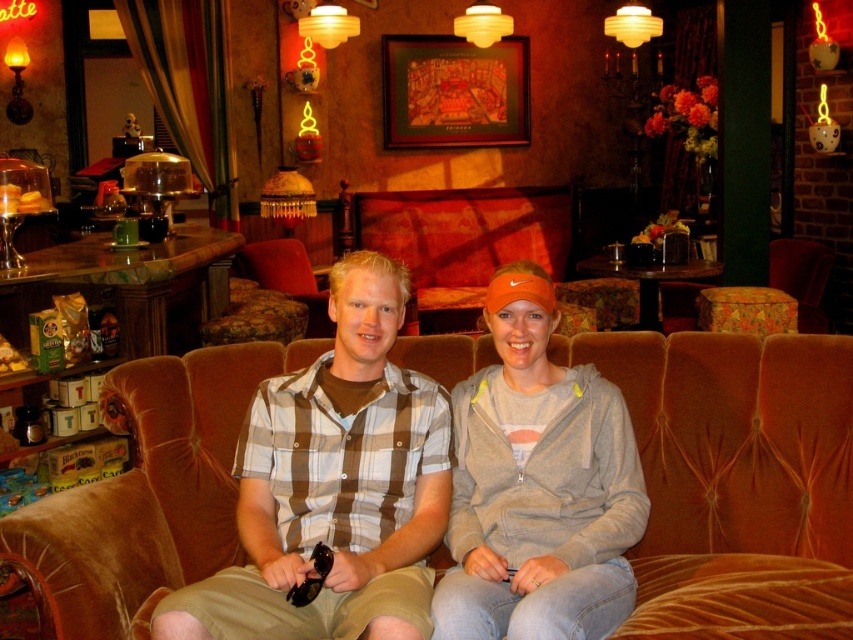
Is velvet brown couch at center wider than gray fleece sweatshirt at center?

Indeed, velvet brown couch at center has a greater width compared to gray fleece sweatshirt at center.

Is point (178, 509) positioned before point (636, 524)?

That is False.

Where is `velvet brown couch at center`? velvet brown couch at center is located at coordinates (737, 480).

Is velvet brown couch at center behind plaid shirt at center?

Yes.

Which is in front, point (846, 611) or point (247, 522)?

Point (846, 611) is more forward.

Is point (682, 600) behind point (395, 396)?

No, it is not.

Where is `velvet brown couch at center`? Image resolution: width=853 pixels, height=640 pixels. velvet brown couch at center is located at coordinates (737, 480).

Who is more distant from viewer, (374, 332) or (640, 472)?

The point (640, 472) is more distant.

Who is more forward, (x=386, y=280) or (x=540, y=620)?

Point (x=540, y=620)

This screenshot has height=640, width=853. I want to click on plaid shirt at center, so click(x=334, y=484).